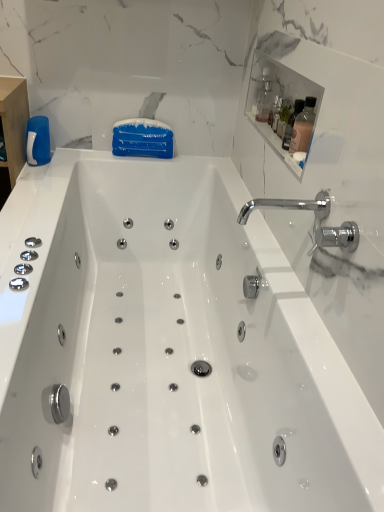
Question: Is blue glossy bottle at left wider than clear glass bottle at upper right, which ranks as the 2th bottle in front-to-back order?

Choices:
 (A) yes
 (B) no

Answer: (A)

Question: Is blue glossy bottle at left oriented towards clear glass bottle at upper right, the first bottle when ordered from back to front?

Choices:
 (A) no
 (B) yes

Answer: (A)

Question: Can you confirm if blue glossy bottle at left is thinner than clear glass bottle at upper right, the first bottle when ordered from back to front?

Choices:
 (A) yes
 (B) no

Answer: (B)

Question: Does blue glossy bottle at left come in front of clear glass bottle at upper right, which is the 1th bottle from top to bottom?

Choices:
 (A) yes
 (B) no

Answer: (B)

Question: Is blue glossy bottle at left far from clear glass bottle at upper right, the 2th bottle from the bottom?

Choices:
 (A) no
 (B) yes

Answer: (A)

Question: From the image's perspective, is blue glossy bottle at left below clear glass bottle at upper right, the 2th bottle from the bottom?

Choices:
 (A) no
 (B) yes

Answer: (B)

Question: Is clear glass bottle at upper right, which ranks as the 2th bottle in front-to-back order, far away from white glossy medicine cabinet at upper right?

Choices:
 (A) yes
 (B) no

Answer: (B)

Question: Is clear glass bottle at upper right, the first bottle when ordered from back to front, surrounding white glossy medicine cabinet at upper right?

Choices:
 (A) no
 (B) yes

Answer: (A)

Question: Is clear glass bottle at upper right, the 2th bottle from the bottom, closer to the viewer compared to white glossy medicine cabinet at upper right?

Choices:
 (A) yes
 (B) no

Answer: (B)

Question: From the image's perspective, is clear glass bottle at upper right, which is the 1th bottle from top to bottom, located above white glossy medicine cabinet at upper right?

Choices:
 (A) no
 (B) yes

Answer: (B)

Question: Is clear glass bottle at upper right, which ranks as the 2th bottle in front-to-back order, at the left side of white glossy medicine cabinet at upper right?

Choices:
 (A) no
 (B) yes

Answer: (B)

Question: Does clear glass bottle at upper right, which ranks as the 2th bottle in front-to-back order, appear on the right side of white glossy medicine cabinet at upper right?

Choices:
 (A) yes
 (B) no

Answer: (B)

Question: Is chrome/metallic faucet at upper right to the left of clear glass bottle at upper right, which is the 1th bottle from top to bottom, from the viewer's perspective?

Choices:
 (A) yes
 (B) no

Answer: (A)